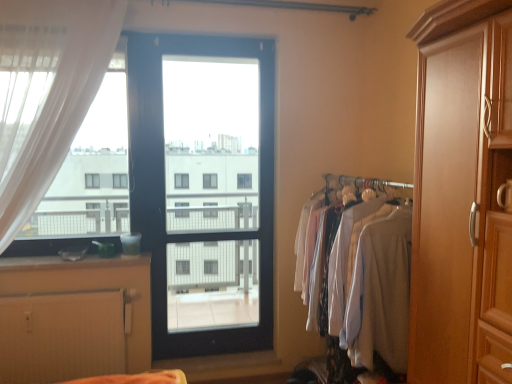
Question: Considering the positions of smooth wooden surface at lower left and light gray fabric shirts at right in the image, is smooth wooden surface at lower left bigger or smaller than light gray fabric shirts at right?

Choices:
 (A) small
 (B) big

Answer: (A)

Question: From the image's perspective, is smooth wooden surface at lower left positioned above or below light gray fabric shirts at right?

Choices:
 (A) above
 (B) below

Answer: (A)

Question: Which of these objects is positioned closest to the white sheer curtain at left?

Choices:
 (A) black glass door at center
 (B) white textured radiator at lower left
 (C) wooden wardrobe at right
 (D) smooth wooden surface at lower left
 (E) light gray fabric shirts at right

Answer: (D)

Question: Based on their relative distances, which object is farther from the smooth wooden surface at lower left?

Choices:
 (A) light gray fabric shirts at right
 (B) wooden wardrobe at right
 (C) black glass door at center
 (D) white textured radiator at lower left
 (E) white sheer curtain at left

Answer: (B)